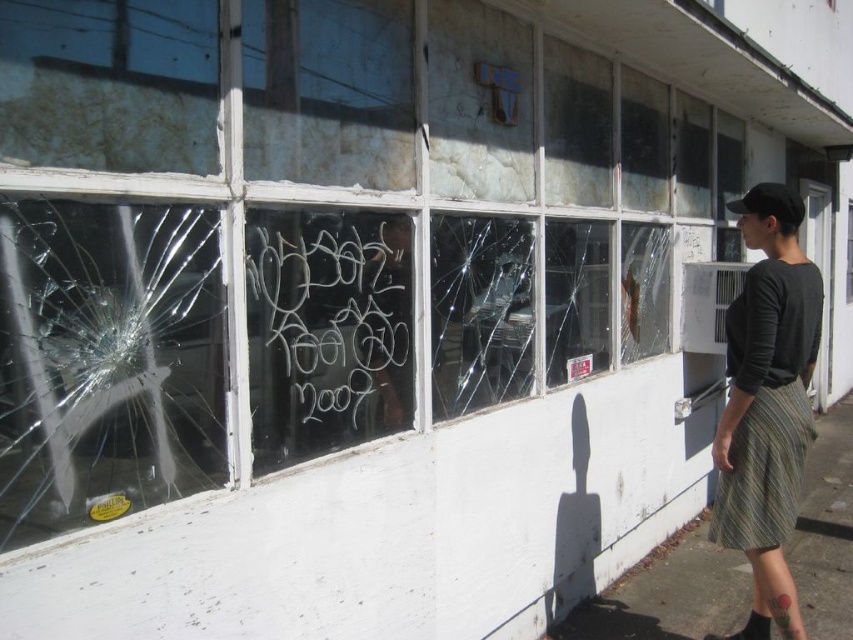
Consider the image. You are standing at point [485,241] and want to move to the front of the building. Can you walk directly towards point [752,580] to reach the front?

Point [752,580] is behind point [485,241], so walking towards it would take you away from the front of the building. You should move in the opposite direction.

You are a photographer trying to capture the scene of the weathered building. You notice the green striped skirt at right and the transparent glass window at center. Which object should you focus on if you want to photograph the larger one?

The green striped skirt at right is larger in size than the transparent glass window at center, so you should focus on the green striped skirt at right.